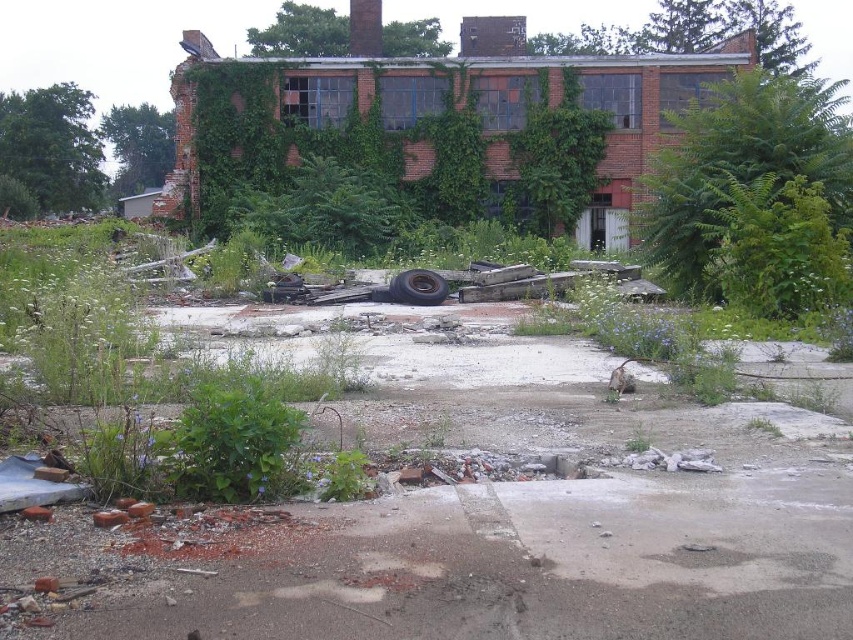
The height and width of the screenshot is (640, 853). What do you see at coordinates (741, 163) in the screenshot?
I see `green leafy plant at upper right` at bounding box center [741, 163].

The height and width of the screenshot is (640, 853). What do you see at coordinates (741, 163) in the screenshot?
I see `green leafy plant at upper right` at bounding box center [741, 163].

You are a GUI agent. You are given a task and a screenshot of the screen. Output one action in this format:
    pyautogui.click(x=<x>, y=<y>)
    Task: Click on the green leafy plant at upper right
    The image size is (853, 640).
    Given the screenshot: What is the action you would take?
    [x=741, y=163]

Is point (33, 131) positioned after point (427, 272)?

Yes, point (33, 131) is farther from viewer.

This screenshot has height=640, width=853. I want to click on green leafy tree at left, so click(x=51, y=145).

Locate an element on the screen. green leafy tree at left is located at coordinates (51, 145).

Is point (764, 129) more distant than point (90, 177)?

That is False.

Is the position of green leafy plant at upper right less distant than that of green leafy tree at left?

Yes, green leafy plant at upper right is in front of green leafy tree at left.

Who is more forward, (782, 77) or (62, 83)?

Point (782, 77) is more forward.

Locate an element on the screen. Image resolution: width=853 pixels, height=640 pixels. green leafy plant at upper right is located at coordinates (741, 163).